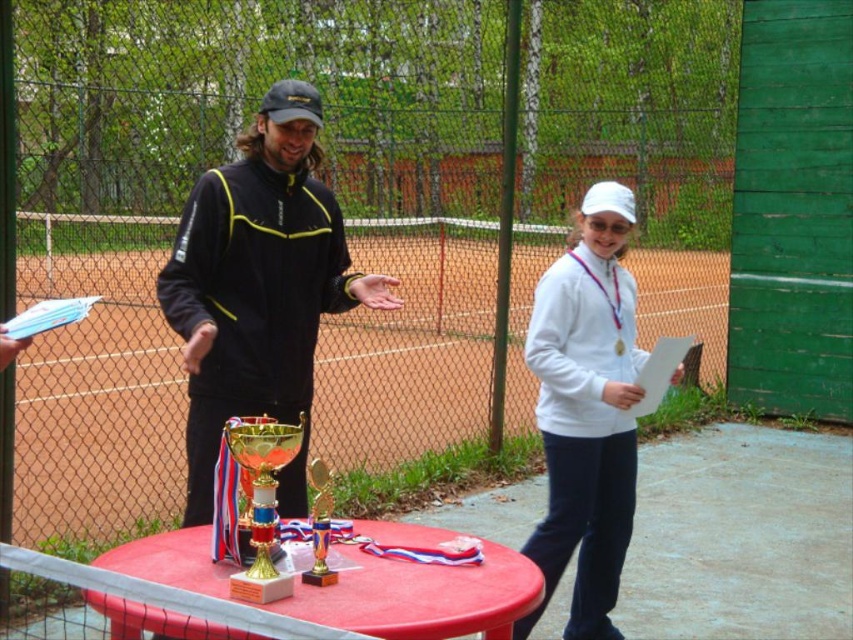
Does smooth plastic table at center have a lesser height compared to gold metallic trophy at center?

Yes, smooth plastic table at center is shorter than gold metallic trophy at center.

Between smooth plastic table at center and gold metallic trophy at center, which one appears on the left side from the viewer's perspective?

Positioned to the left is gold metallic trophy at center.

You are a GUI agent. You are given a task and a screenshot of the screen. Output one action in this format:
    pyautogui.click(x=<x>, y=<y>)
    Task: Click on the smooth plastic table at center
    The height and width of the screenshot is (640, 853).
    Given the screenshot: What is the action you would take?
    pyautogui.click(x=421, y=596)

Image resolution: width=853 pixels, height=640 pixels. I want to click on smooth plastic table at center, so click(421, 596).

Does black softshell jacket at center lie in front of gold metallic trophy at center?

No, black softshell jacket at center is further to the viewer.

Measure the distance between black softshell jacket at center and camera.

The distance of black softshell jacket at center from camera is 3.36 meters.

The width and height of the screenshot is (853, 640). I want to click on black softshell jacket at center, so click(259, 289).

Between point (268, 157) and point (554, 371), which one is positioned behind?

Positioned behind is point (554, 371).

Is black softshell jacket at center taller than white matte jacket at center?

In fact, black softshell jacket at center may be shorter than white matte jacket at center.

Is point (305, 298) in front of point (614, 532)?

That is True.

Image resolution: width=853 pixels, height=640 pixels. Find the location of `black softshell jacket at center`. black softshell jacket at center is located at coordinates (259, 289).